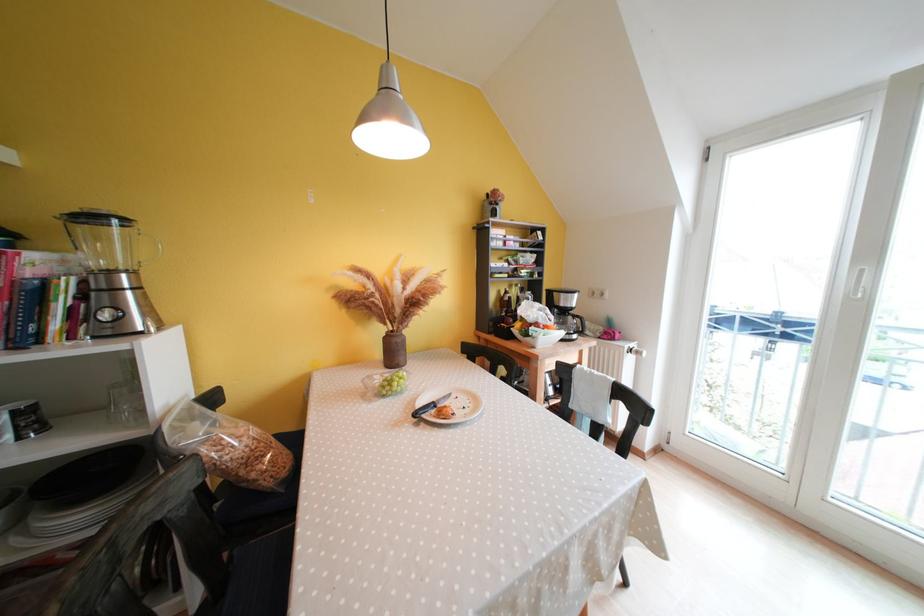
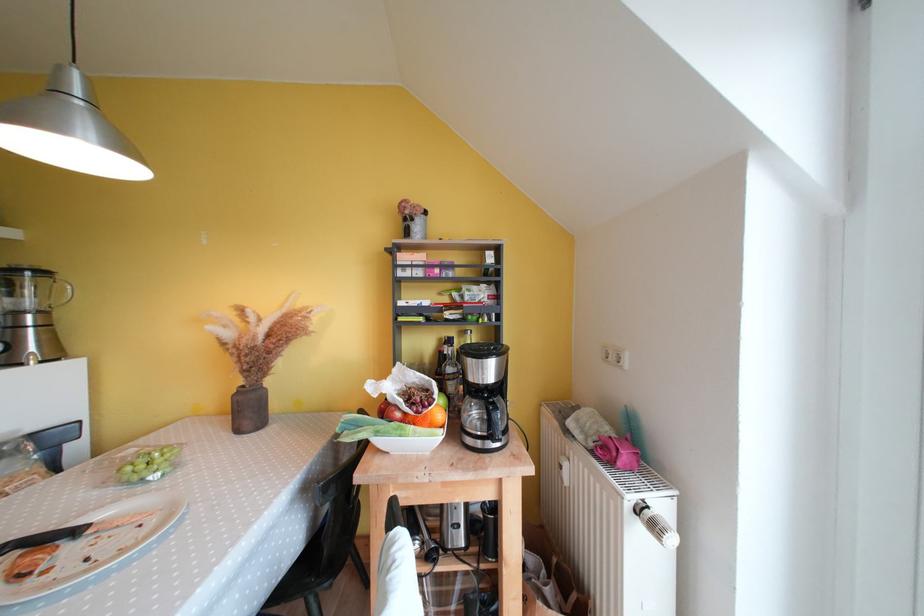
Find the pixel in the second image that matches [505,294] in the first image.

(446, 342)